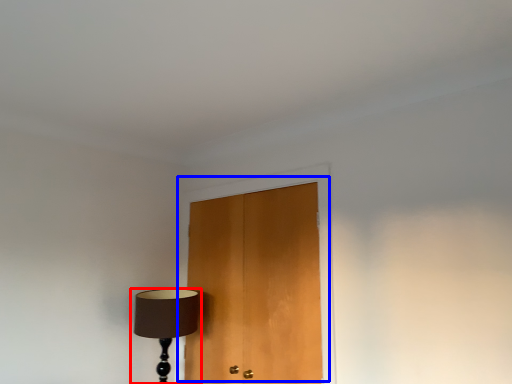
Question: Among these objects, which one is nearest to the camera, lamp (highlighted by a red box) or door (highlighted by a blue box)?

Choices:
 (A) lamp
 (B) door

Answer: (B)